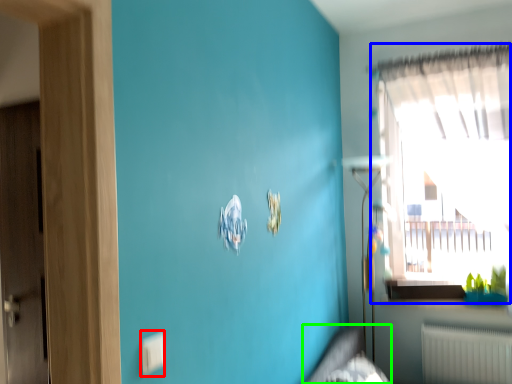
Question: Based on their relative distances, which object is nearer to electric outlet (highlighted by a red box)? Choose from window (highlighted by a blue box) and bed frame (highlighted by a green box).

Choices:
 (A) window
 (B) bed frame

Answer: (B)